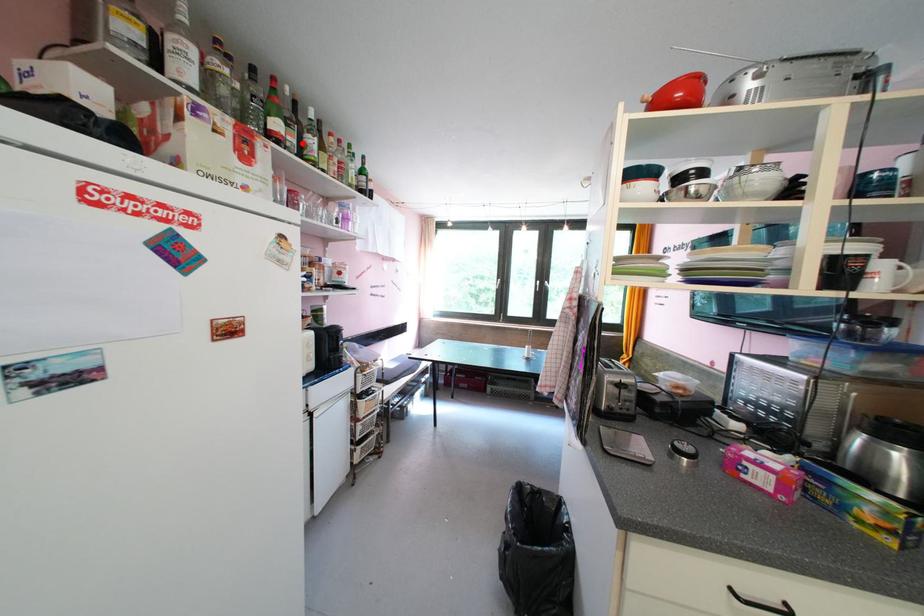
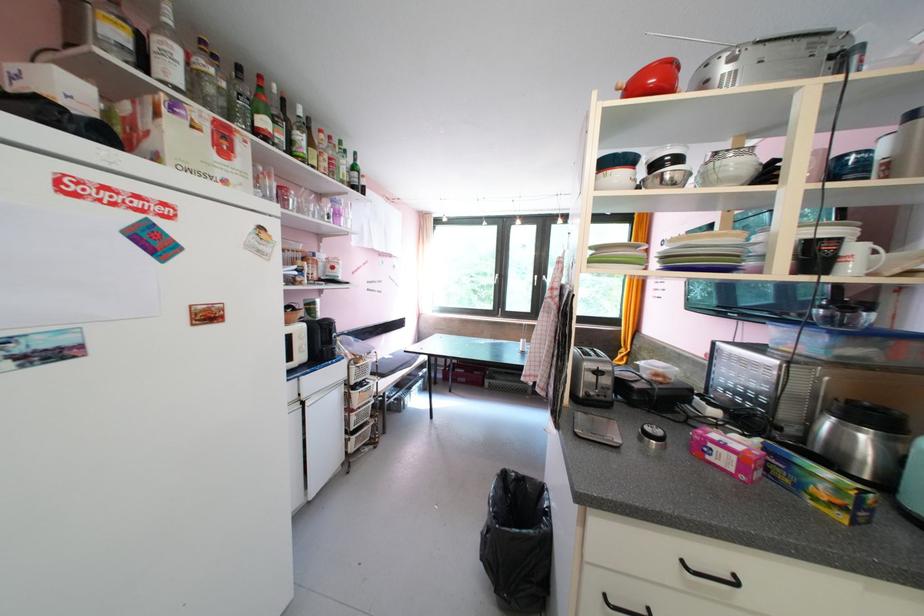
In the second image, find the point that corresponds to the highlighted location in the first image.

(290, 140)